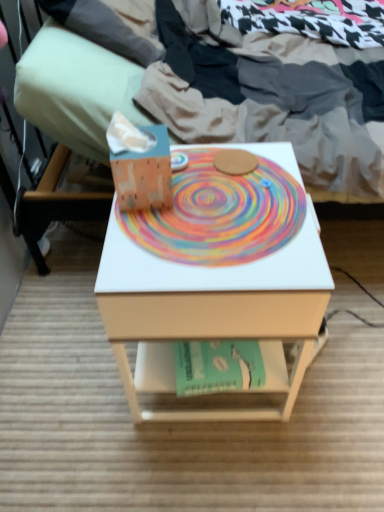
Question: Does matte green pillow at upper left lie behind teal paper at center?

Choices:
 (A) no
 (B) yes

Answer: (B)

Question: From the image's perspective, is matte green pillow at upper left beneath teal paper at center?

Choices:
 (A) no
 (B) yes

Answer: (A)

Question: From the image's perspective, is matte green pillow at upper left located above teal paper at center?

Choices:
 (A) no
 (B) yes

Answer: (B)

Question: Is matte green pillow at upper left taller than teal paper at center?

Choices:
 (A) no
 (B) yes

Answer: (B)

Question: Is teal paper at center a part of matte green pillow at upper left?

Choices:
 (A) yes
 (B) no

Answer: (B)

Question: From a real-world perspective, is matte green pillow at upper left above or below white matte desk at center?

Choices:
 (A) above
 (B) below

Answer: (A)

Question: Is matte green pillow at upper left in front of or behind white matte desk at center in the image?

Choices:
 (A) behind
 (B) front

Answer: (A)

Question: Considering the relative positions of matte green pillow at upper left and white matte desk at center in the image provided, is matte green pillow at upper left to the left or to the right of white matte desk at center?

Choices:
 (A) right
 (B) left

Answer: (B)

Question: Does point pyautogui.click(x=105, y=159) appear closer or farther from the camera than point pyautogui.click(x=168, y=321)?

Choices:
 (A) farther
 (B) closer

Answer: (A)

Question: Considering the positions of matte white bed at center and matte orange tissue box at center in the image, is matte white bed at center taller or shorter than matte orange tissue box at center?

Choices:
 (A) short
 (B) tall

Answer: (B)

Question: Is point (130, 104) closer or farther from the camera than point (124, 167)?

Choices:
 (A) closer
 (B) farther

Answer: (B)

Question: From the image's perspective, is matte white bed at center above or below matte orange tissue box at center?

Choices:
 (A) above
 (B) below

Answer: (A)

Question: Is matte white bed at center in front of or behind matte orange tissue box at center in the image?

Choices:
 (A) front
 (B) behind

Answer: (B)

Question: Is matte white bed at center to the left or to the right of white matte desk at center in the image?

Choices:
 (A) left
 (B) right

Answer: (B)

Question: From the image's perspective, is matte white bed at center above or below white matte desk at center?

Choices:
 (A) above
 (B) below

Answer: (A)